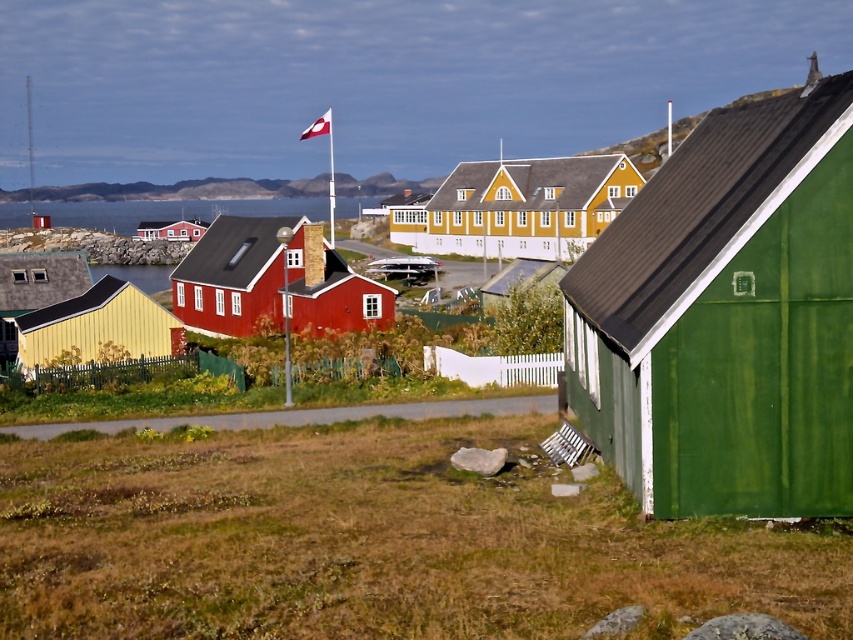
Does yellow wood house at center appear over transparent water at center?

No.

Who is taller, yellow wood house at center or transparent water at center?

Standing taller between the two is yellow wood house at center.

Who is more forward, (556,170) or (305,204)?

Positioned in front is point (556,170).

The image size is (853, 640). Find the location of `yellow wood house at center`. yellow wood house at center is located at coordinates (517, 205).

Does green matte wood hut at right lie in front of smooth rock formation at upper center?

Yes, green matte wood hut at right is in front of smooth rock formation at upper center.

Who is more forward, (704, 369) or (57, 189)?

Point (704, 369) is in front.

Measure the distance between point (x=601, y=412) and camera.

They are 26.51 meters apart.

Locate an element on the screen. green matte wood hut at right is located at coordinates (727, 316).

From the picture: Who is positioned more to the right, yellow wood house at center or matte red house at center?

yellow wood house at center

Who is more distant from viewer, (534, 227) or (173, 228)?

The point (173, 228) is more distant.

The width and height of the screenshot is (853, 640). Find the location of `yellow wood house at center`. yellow wood house at center is located at coordinates (517, 205).